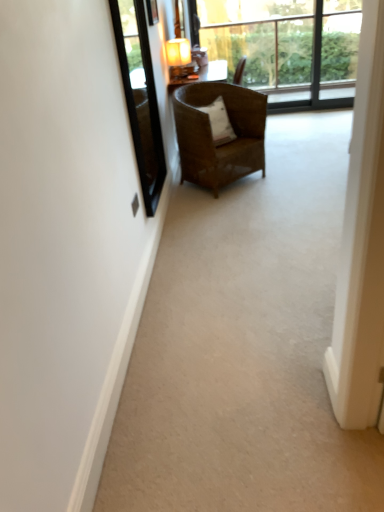
Locate an element on the screen. vacant area situated below white glossy screen door at right (from a real-world perspective) is located at coordinates (370, 458).